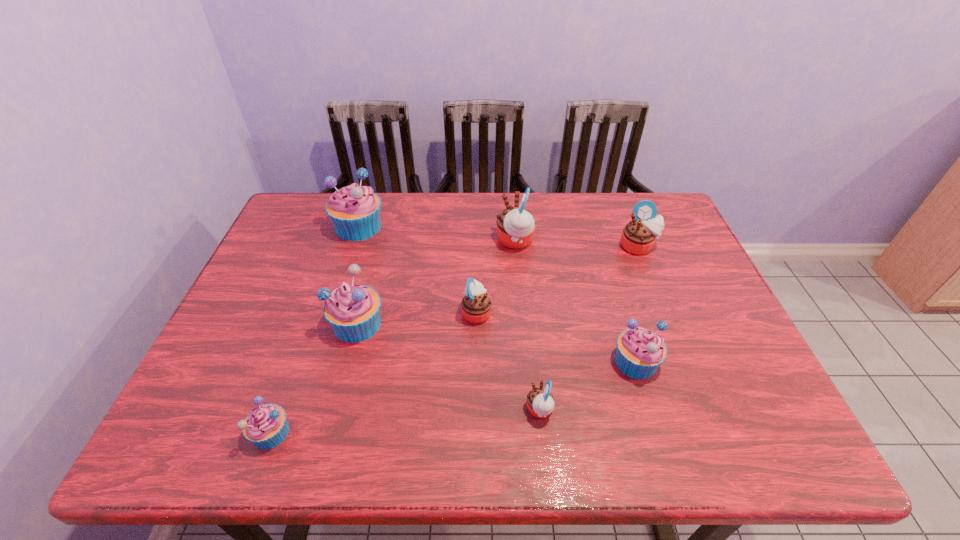
The width and height of the screenshot is (960, 540). Find the location of `empty space between the smallest blue muffin and the rightmost muffin`. empty space between the smallest blue muffin and the rightmost muffin is located at coordinates pos(455,340).

The width and height of the screenshot is (960, 540). Find the location of `vacant space in between the fifth object from right to left and the seventh object from left to right`. vacant space in between the fifth object from right to left and the seventh object from left to right is located at coordinates (556, 337).

You are a GUI agent. You are given a task and a screenshot of the screen. Output one action in this format:
    pyautogui.click(x=<x>, y=<y>)
    Task: Click on the unoccupied area between the farthest blue muffin and the biggest pink muffin
    The image size is (960, 540).
    Given the screenshot: What is the action you would take?
    pyautogui.click(x=437, y=234)

Locate an element on the screen. The height and width of the screenshot is (540, 960). the second closest object to the third biggest blue muffin is located at coordinates (476, 305).

Identify the location of object that is the sixth closest to the farthest blue muffin. (640, 352).

Where is `muffin that is the closest to the biggest blue muffin`? muffin that is the closest to the biggest blue muffin is located at coordinates (353, 310).

Point out which muffin is positioned as the second nearest to the biggest pink muffin. Please provide its 2D coordinates. Your answer should be formatted as a tuple, i.e. [(x, y)], where the tuple contains the x and y coordinates of a point satisfying the conditions above.

[(638, 237)]

Locate an element on the screen. pink muffin that is the nearest to the nearest blue muffin is located at coordinates (476, 305).

At what (x,y) coordinates should I click in order to perform the action: click on the third closest pink muffin relative to the rightmost object. Please return your answer as a coordinate pair (x, y). Looking at the image, I should click on (540, 401).

I want to click on the third closest blue muffin to the second muffin from right to left, so click(355, 211).